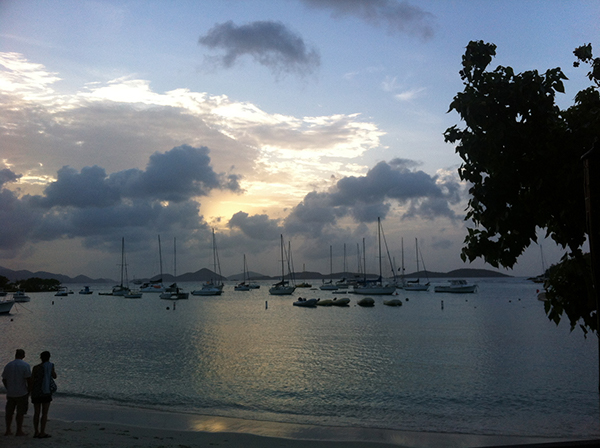
Locate an element on the screen. The height and width of the screenshot is (448, 600). towel is located at coordinates (47, 389).